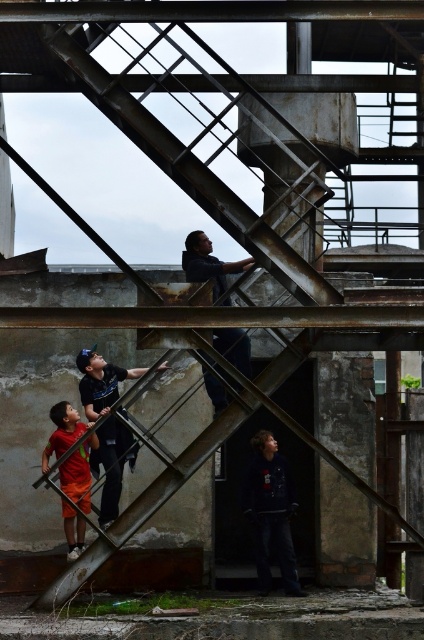
Question: In this image, where is orange cotton shorts at lower left located relative to dark blue shirt at center?

Choices:
 (A) above
 (B) below

Answer: (B)

Question: Which point is farther to the camera?

Choices:
 (A) dark blue jacket at lower center
 (B) dark blue shirt at center
 (C) orange cotton shorts at lower left

Answer: (A)

Question: Considering the real-world distances, which object is farthest from the orange cotton shorts at lower left?

Choices:
 (A) dark blue jacket at lower center
 (B) dark blue shirt at center

Answer: (B)

Question: Is dark blue jacket at lower center further to camera compared to dark blue shirt at center?

Choices:
 (A) yes
 (B) no

Answer: (A)

Question: Which object appears closest to the camera in this image?

Choices:
 (A) dark blue jacket at lower center
 (B) orange cotton shorts at lower left
 (C) dark blue shirt at center

Answer: (B)

Question: Can you confirm if orange cotton shorts at lower left is smaller than dark blue shirt at center?

Choices:
 (A) no
 (B) yes

Answer: (B)